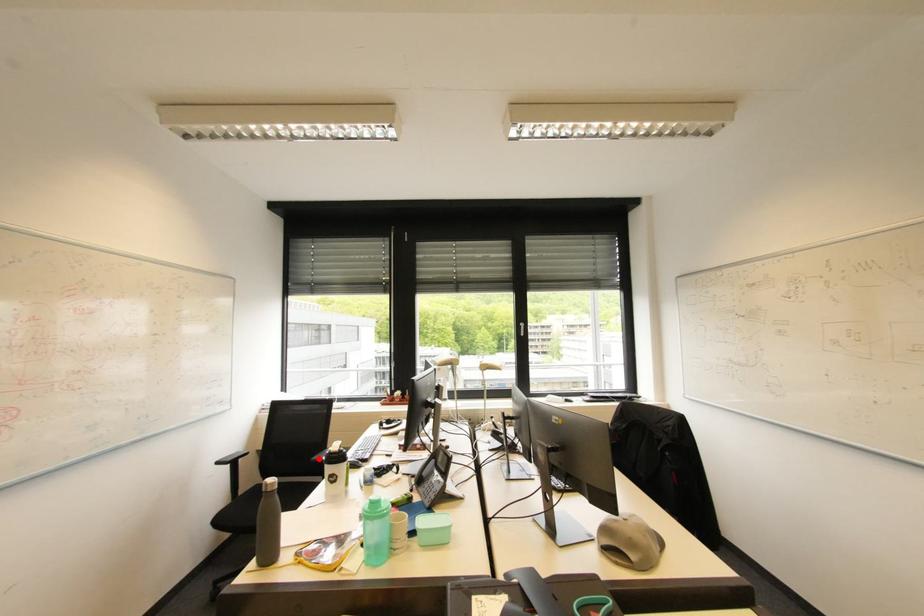
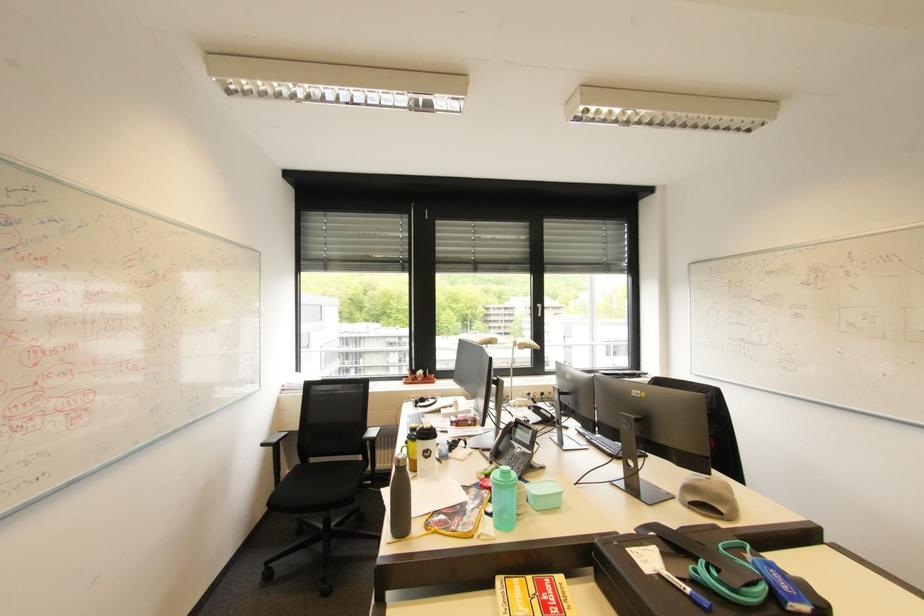
Locate, in the second image, the point that corresponds to the highlighted location in the first image.

(370, 438)